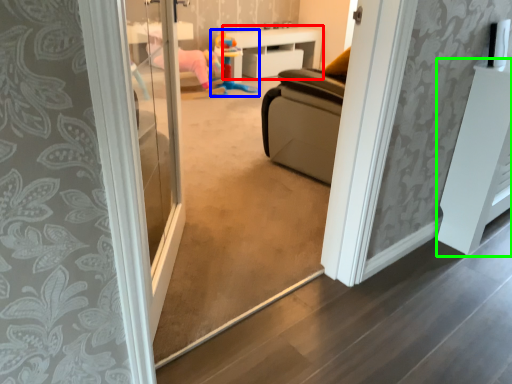
Question: Which is nearer to the furniture (highlighted by a red box)? toy (highlighted by a blue box) or furniture (highlighted by a green box).

Choices:
 (A) toy
 (B) furniture

Answer: (A)